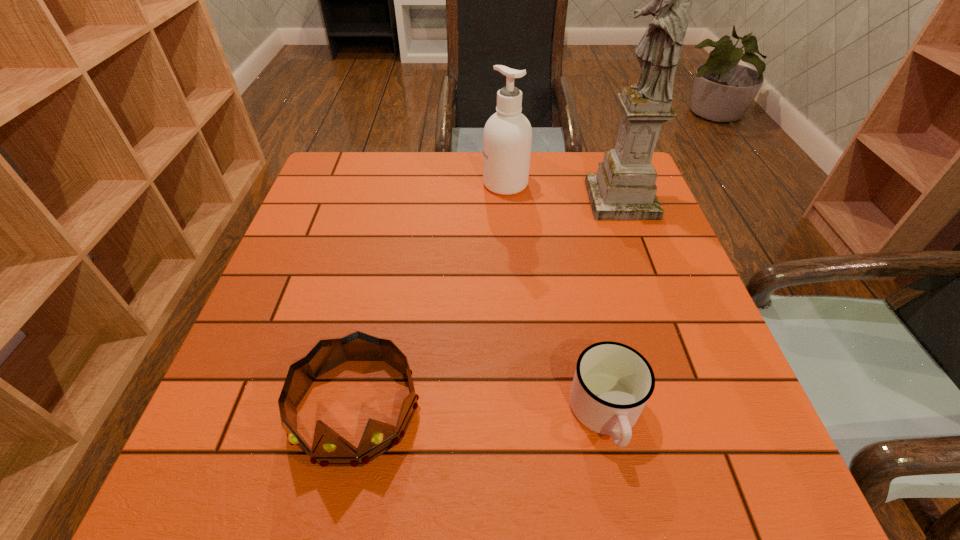
Image resolution: width=960 pixels, height=540 pixels. Find the location of `object that is the nearest to the second shortest object`. object that is the nearest to the second shortest object is located at coordinates [612, 383].

Identify the location of free spot that satisfies the following two spatial constraints: 1. on the front label of the third shortest object; 2. at the front of the leftmost object with jewels. (521, 409).

Find the location of a particular element. Image resolution: width=960 pixels, height=540 pixels. free space that satisfies the following two spatial constraints: 1. on the front-facing side of the tallest object; 2. on the side of the second object from right to left with the handle is located at coordinates (700, 414).

I want to click on vacant space that satisfies the following two spatial constraints: 1. on the front-facing side of the sculpture; 2. at the front of the leftmost object with jewels, so click(698, 409).

Where is `free space in the image that satisfies the following two spatial constraints: 1. on the front-facing side of the sculpture; 2. at the front of the leftmost object with jewels`? free space in the image that satisfies the following two spatial constraints: 1. on the front-facing side of the sculpture; 2. at the front of the leftmost object with jewels is located at coordinates (698, 409).